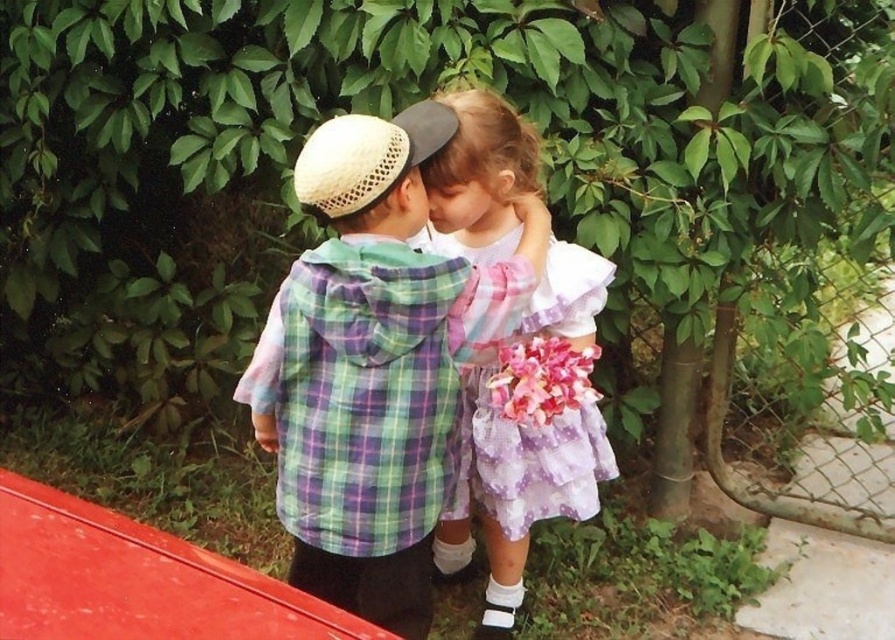
Consider the image. Can you confirm if plaid fabric shirt at center is smaller than rusty metal fence at right?

Actually, plaid fabric shirt at center might be larger than rusty metal fence at right.

Does plaid fabric shirt at center appear on the right side of rusty metal fence at right?

In fact, plaid fabric shirt at center is to the left of rusty metal fence at right.

Image resolution: width=895 pixels, height=640 pixels. Find the location of `plaid fabric shirt at center`. plaid fabric shirt at center is located at coordinates (373, 365).

Does rusty metal fence at right have a greater height compared to pink fabric flower at center?

Indeed, rusty metal fence at right has a greater height compared to pink fabric flower at center.

Consider the image. Who is more forward, (787, 512) or (534, 374)?

Point (534, 374) is in front.

Does point (778, 512) come in front of point (558, 371)?

No, it is behind (558, 371).

Locate an element on the screen. The image size is (895, 640). rusty metal fence at right is located at coordinates (738, 476).

Looking at this image, does purple polka dot dress at center have a greater width compared to pink fabric flower at center?

Yes.

Measure the distance between point (510, 244) and camera.

Point (510, 244) and camera are 1.85 meters apart.

At what (x,y) coordinates should I click in order to perform the action: click on purple polka dot dress at center. Please return your answer as a coordinate pair (x, y). The height and width of the screenshot is (640, 895). Looking at the image, I should click on (527, 461).